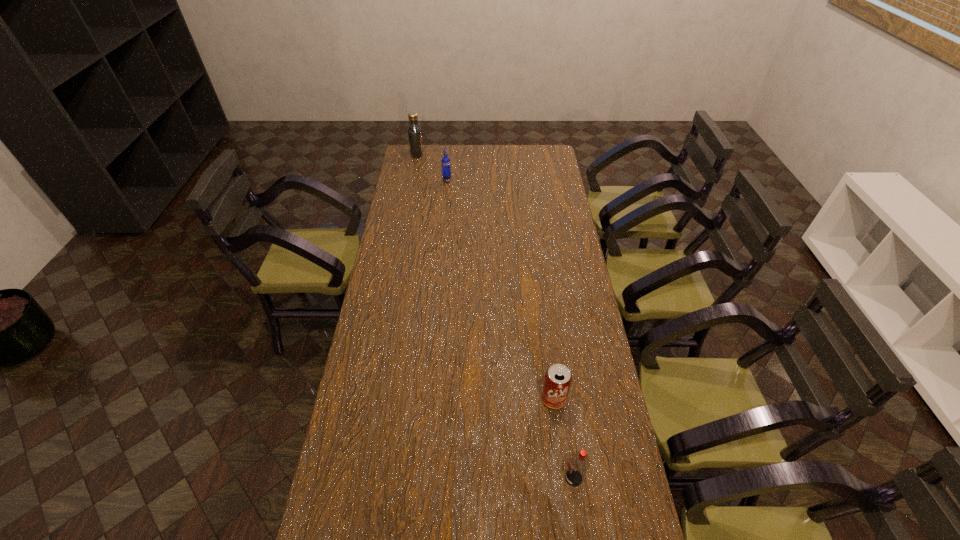
This screenshot has width=960, height=540. Find the location of `the tallest vodka`. the tallest vodka is located at coordinates (414, 131).

You are a GUI agent. You are given a task and a screenshot of the screen. Output one action in this format:
    pyautogui.click(x=<x>, y=<y>)
    Task: Click on the tallest object
    This screenshot has height=540, width=960.
    Given the screenshot: What is the action you would take?
    pyautogui.click(x=414, y=131)

Where is `the second vodka from right to left`? The width and height of the screenshot is (960, 540). the second vodka from right to left is located at coordinates (446, 167).

At what (x,y) coordinates should I click in order to perform the action: click on the second farthest object. Please return your answer as a coordinate pair (x, y). Looking at the image, I should click on (446, 167).

Find the location of a particular element. The image size is (960, 540). the nearest object is located at coordinates (579, 463).

The width and height of the screenshot is (960, 540). Find the location of `the rightmost vodka`. the rightmost vodka is located at coordinates (579, 463).

I want to click on soda can, so click(557, 381).

Locate an element on the screen. This screenshot has width=960, height=540. free spot located 0.170m on the front-facing side of the leftmost vodka is located at coordinates (454, 153).

I want to click on vacant region located 0.380m on the front of the second vodka from right to left, so click(x=443, y=232).

Where is `vacant space positioned on the front label of the rightmost vodka`? The image size is (960, 540). vacant space positioned on the front label of the rightmost vodka is located at coordinates (515, 478).